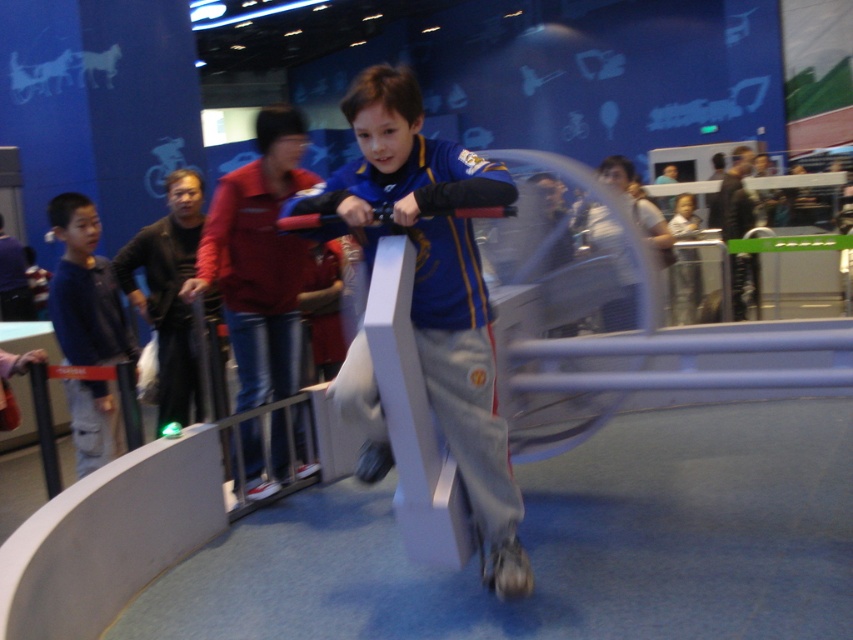
You are a fashion designer observing the jackets in the exhibit. You need to decide which jacket to recommend for a client who prefers wider sleeves. Which jacket between the blue fabric jacket at center and the blue denim jacket at left should you choose?

The blue fabric jacket at center has a greater width than the blue denim jacket at left, so it is the better choice for wider sleeves.

You are a security guard at the exhibit and need to locate two jackets left by visitors. The jackets are the blue fabric jacket at center and the blue denim jacket at left. Which jacket is closer to the entrance located at the back of the room?

The blue fabric jacket at center is closer to the entrance located at the back of the room because it is positioned in front of the blue denim jacket at left, meaning it is nearer to the back entrance.

You are a security guard at the exhibit and need to ensure visitors are maintaining a safe distance of at least 6 feet from the VR dome. The blue fabric jacket at center is part of a visitor currently interacting with the dome. Is the visitor complying with the safety distance requirement?

The blue fabric jacket at center is 6.51 feet away from camera, which exceeds the required 6 feet distance. Therefore, the visitor is complying with the safety distance requirement.